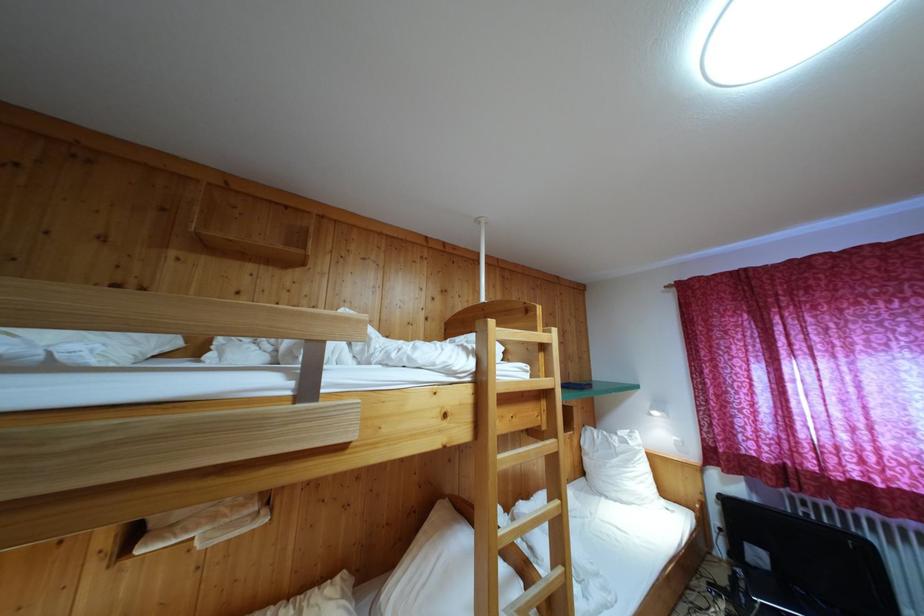
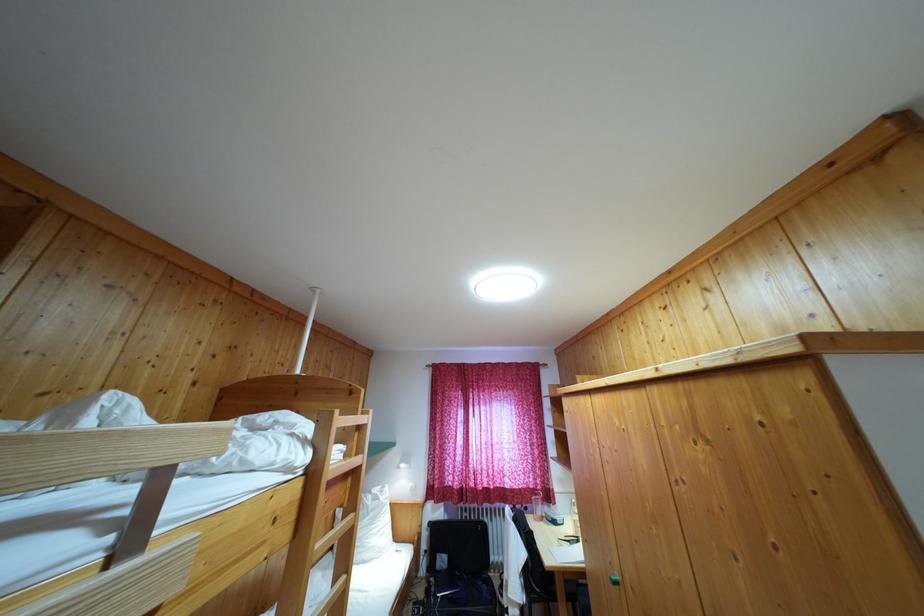
Locate, in the second image, the point that corresponds to point (761, 562) in the first image.

(445, 567)